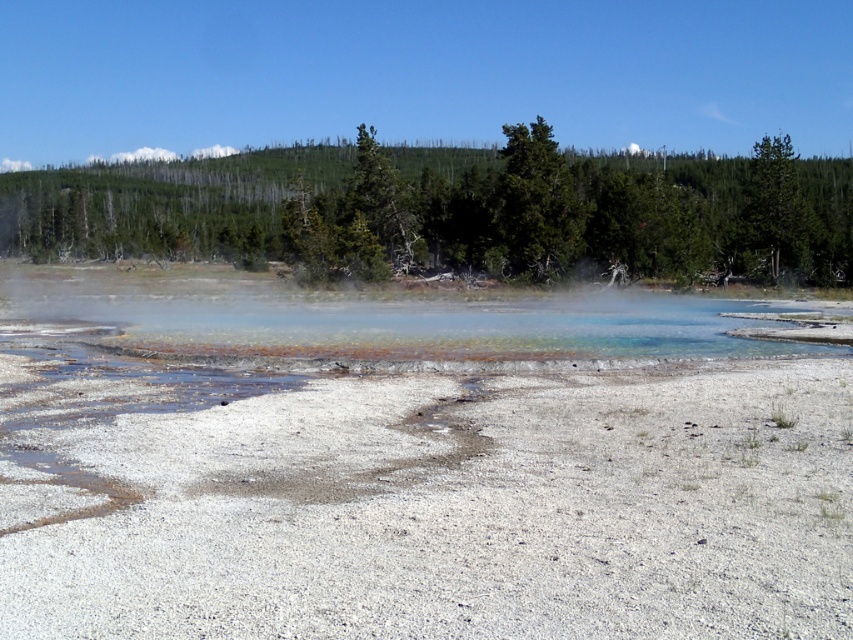
Question: Among these points, which one is farthest from the camera?

Choices:
 (A) (767, 209)
 (B) (254, 296)
 (C) (456, 262)
 (D) (505, 180)

Answer: (C)

Question: Does green leafy tree at upper center come in front of translucent mineral water at center?

Choices:
 (A) no
 (B) yes

Answer: (A)

Question: Which point is closer to the camera taking this photo?

Choices:
 (A) (370, 170)
 (B) (535, 323)
 (C) (753, 186)

Answer: (B)

Question: Does green leafy tree at upper center appear over green matte tree at center?

Choices:
 (A) yes
 (B) no

Answer: (B)

Question: Can you confirm if green leafy tree at upper center is positioned to the left of green matte tree at upper right?

Choices:
 (A) no
 (B) yes

Answer: (B)

Question: Which point appears closest to the camera in this image?

Choices:
 (A) (90, 323)
 (B) (756, 202)
 (C) (524, 157)
 (D) (738, 273)

Answer: (A)